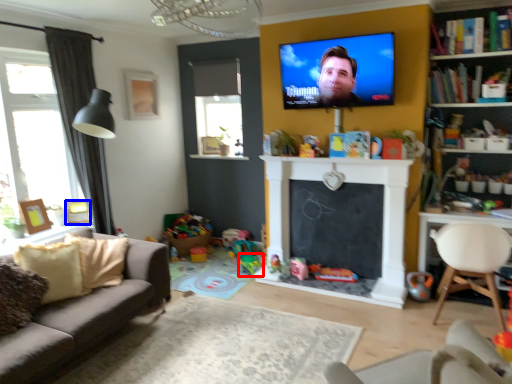
Question: Which point is further to the camera, toy (highlighted by a red box) or picture frame (highlighted by a blue box)?

Choices:
 (A) toy
 (B) picture frame

Answer: (A)